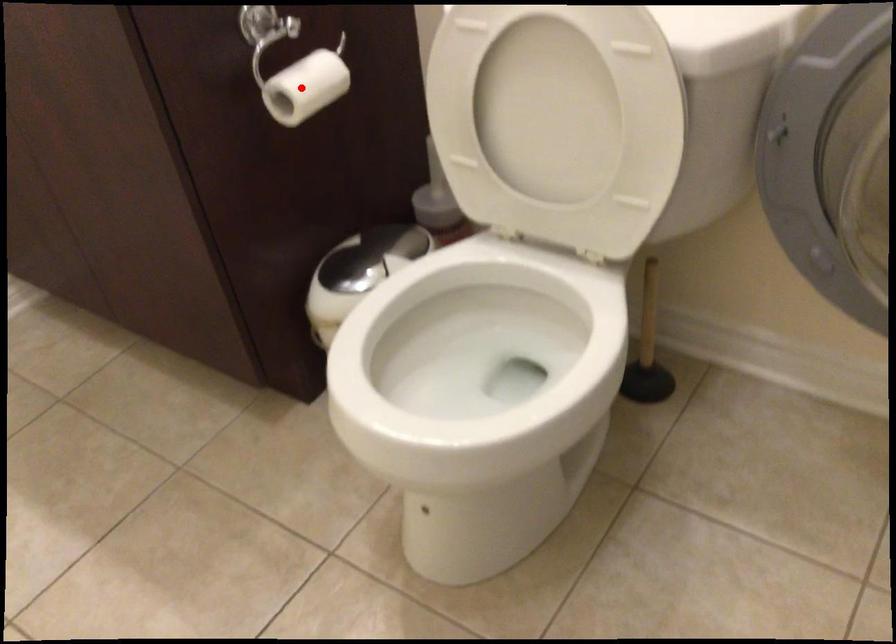
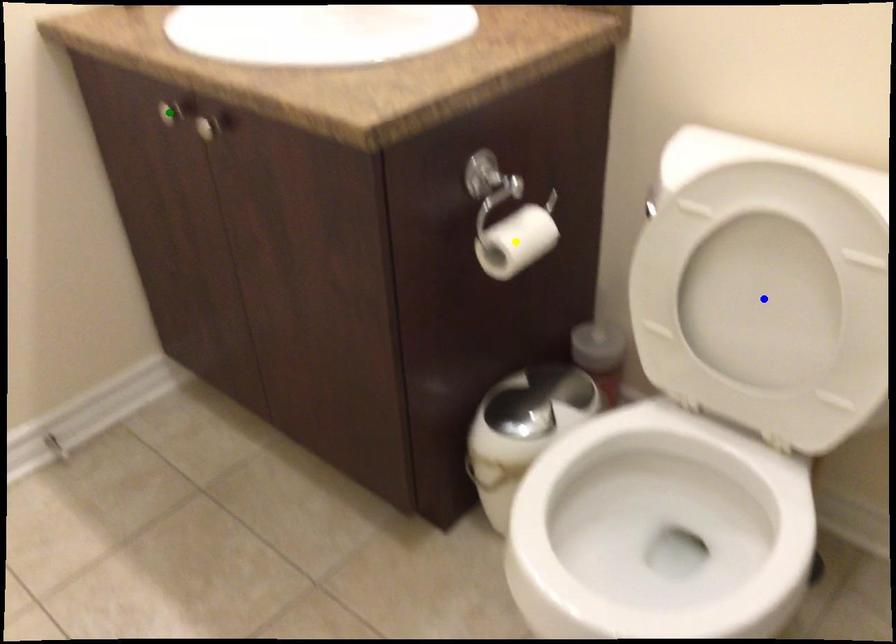
Question: I am providing you with two images of the same scene from different viewpoints. A red point is marked on the first image. You are given multiple points on the second image. Can you choose the point in image 2 that corresponds to the point in image 1?

Choices:
 (A) green point
 (B) yellow point
 (C) blue point

Answer: (B)